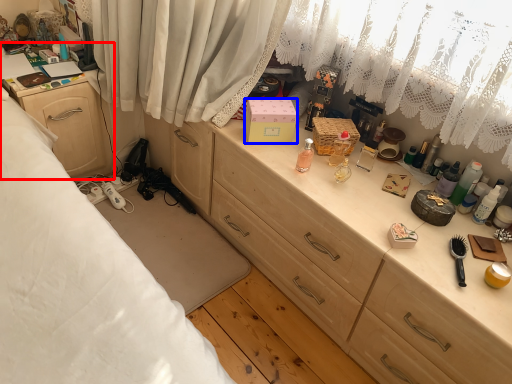
Question: Which object is closer to the camera taking this photo, cabinetry (highlighted by a red box) or box (highlighted by a blue box)?

Choices:
 (A) cabinetry
 (B) box

Answer: (B)